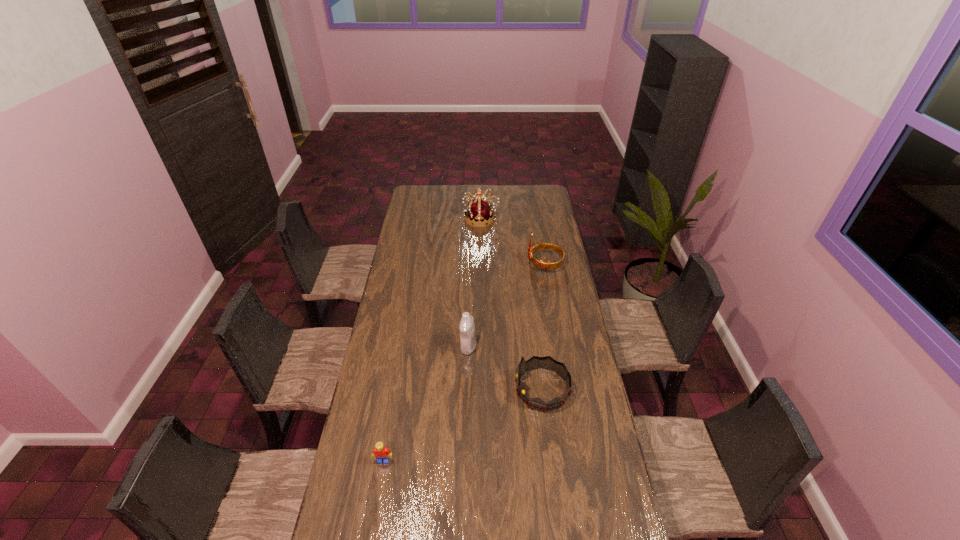
Where is `vacant space at the left edge`? The width and height of the screenshot is (960, 540). vacant space at the left edge is located at coordinates (385, 382).

What are the coordinates of `free space at the right edge of the desktop` in the screenshot? It's located at (550, 210).

At what (x,y) coordinates should I click in order to perform the action: click on free spot at the far right corner of the desktop. Please return your answer as a coordinate pair (x, y). The image size is (960, 540). Looking at the image, I should click on (535, 194).

Where is `vacant point located between the Lego and the leftmost tiara`? The width and height of the screenshot is (960, 540). vacant point located between the Lego and the leftmost tiara is located at coordinates (432, 340).

I want to click on vacant area between the second shortest object and the second nearest tiara, so click(x=543, y=326).

I want to click on vacant point located between the second nearest object and the second farthest tiara, so click(x=543, y=326).

Identify the location of vacant space that is in between the detergent and the second nearest object. click(x=505, y=368).

Find the location of a particular element. free space between the farthest object and the third farthest object is located at coordinates coord(474,283).

In order to click on empty space that is in between the fourth farthest object and the Lego in this screenshot , I will do `click(463, 424)`.

Identify the location of free point between the farthest object and the leftmost object. The height and width of the screenshot is (540, 960). (432, 340).